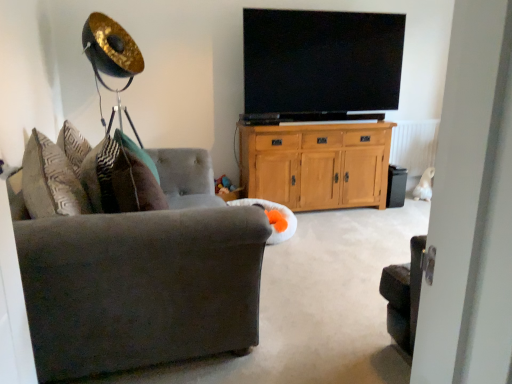
At what (x,y) coordinates should I click in order to perform the action: click on free spot in front of light oak cabinet at center. Please return your answer as a coordinate pair (x, y). Looking at the image, I should click on (340, 246).